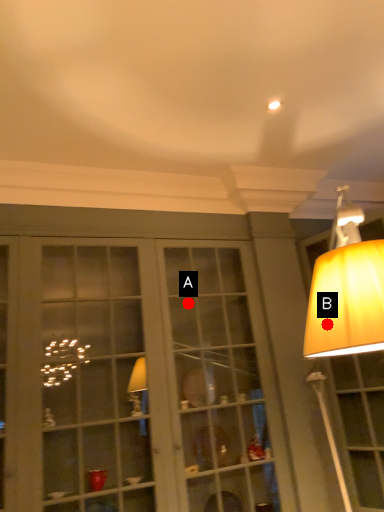
Question: Two points are circled on the image, labeled by A and B beside each circle. Which point is closer to the camera?

Choices:
 (A) A is closer
 (B) B is closer

Answer: (B)